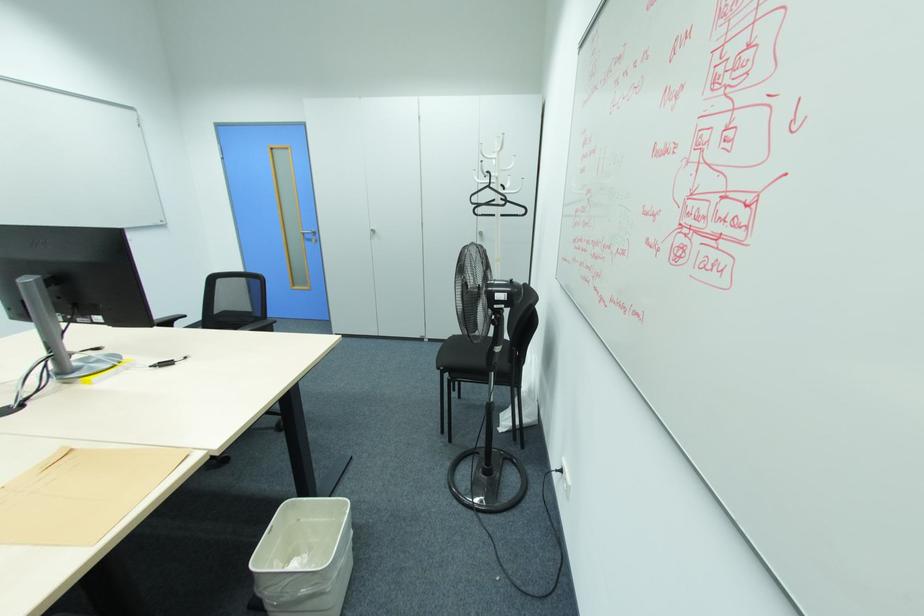
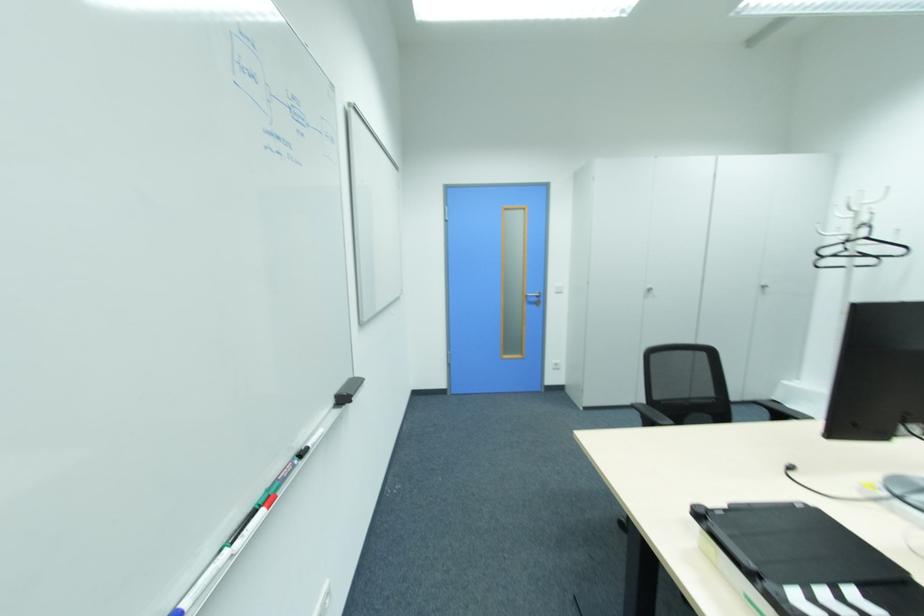
In the second image, find the point that corresponds to the point at 490,187 in the first image.

(865, 238)